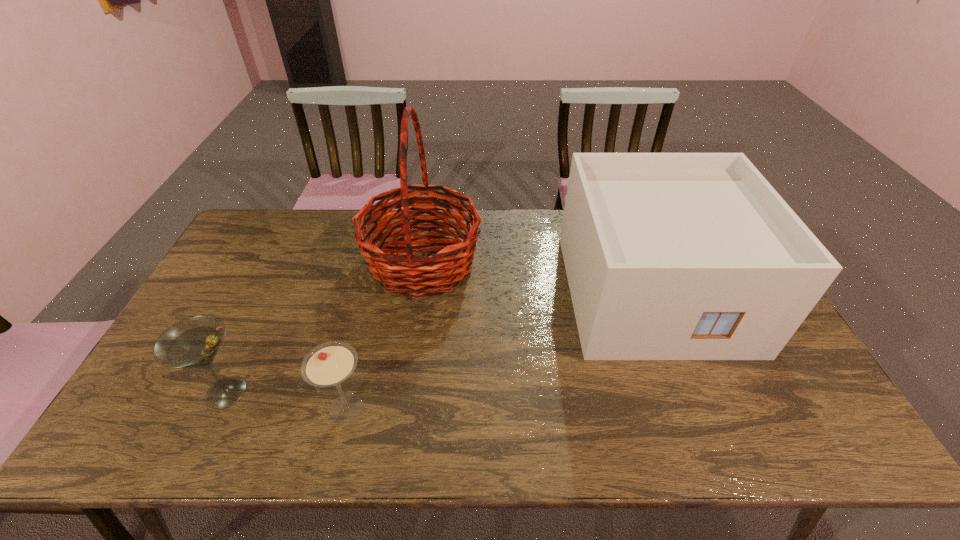
Locate an element on the screen. vacant space at the far left corner of the desktop is located at coordinates [x=259, y=221].

The width and height of the screenshot is (960, 540). I want to click on free space at the near left corner of the desktop, so tap(165, 444).

In the image, there is a desktop. At what (x,y) coordinates should I click in order to perform the action: click on blank space at the near right corner. Please return your answer as a coordinate pair (x, y). Looking at the image, I should click on (785, 432).

I want to click on vacant space that is in between the left martini and the shorter martini, so click(287, 400).

You are a GUI agent. You are given a task and a screenshot of the screen. Output one action in this format:
    pyautogui.click(x=<x>, y=<y>)
    Task: Click on the free space between the right martini and the rightmost object
    This screenshot has height=540, width=960.
    Given the screenshot: What is the action you would take?
    pyautogui.click(x=499, y=350)

At what (x,y) coordinates should I click in order to perform the action: click on blank region between the basket and the box. Please return your answer as a coordinate pair (x, y). Image resolution: width=960 pixels, height=540 pixels. Looking at the image, I should click on (538, 278).

Locate an element on the screen. free space between the shorter martini and the box is located at coordinates (499, 350).

This screenshot has height=540, width=960. What are the coordinates of `unoccupied position between the left martini and the shorter martini` in the screenshot? It's located at (287, 400).

Locate an element on the screen. The width and height of the screenshot is (960, 540). free space between the shortest object and the tallest object is located at coordinates (385, 335).

I want to click on blank region between the second shortest object and the box, so click(440, 342).